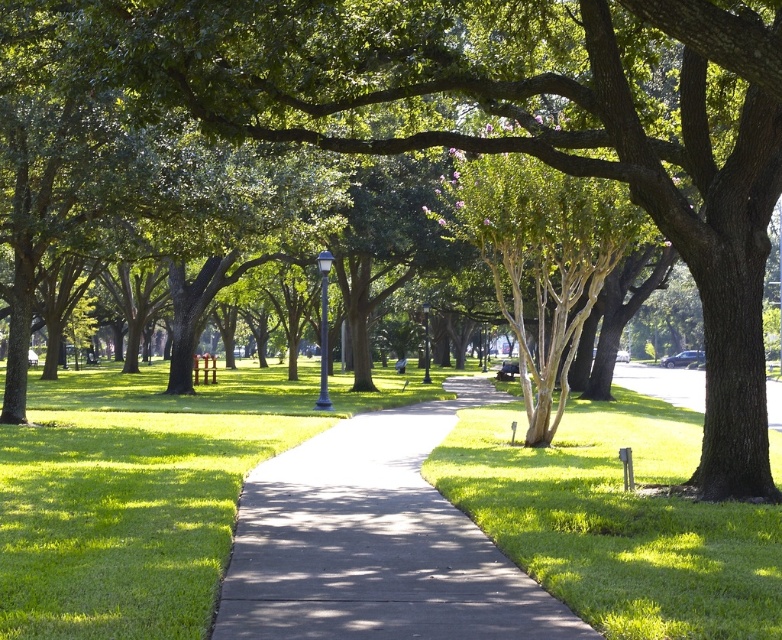
Does point (762, 616) come in front of point (551, 634)?

No.

From the picture: Who is more forward, (526, 515) or (447, 380)?

Point (526, 515)

Which is behind, point (748, 528) or point (336, 586)?

Point (748, 528)

Where is `green grass at center`? green grass at center is located at coordinates (615, 518).